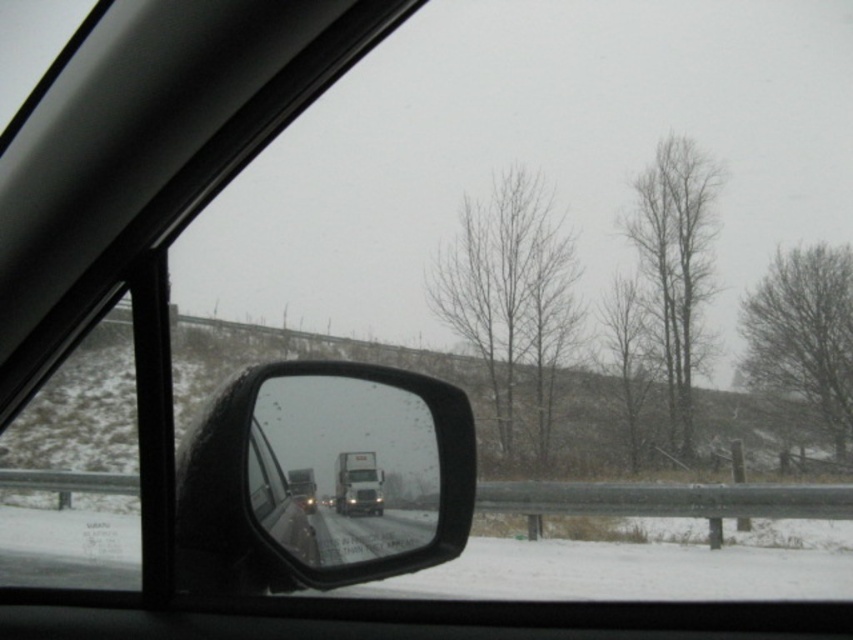
Consider the image. Which is more to the right, black glossy rearview mirror at center or white glossy trailer truck at center?

Answer: From the viewer's perspective, white glossy trailer truck at center appears more on the right side.

Who is more forward, (350, 432) or (375, 497)?

Positioned in front is point (350, 432).

In order to click on black glossy rearview mirror at center in this screenshot , I will do `click(321, 477)`.